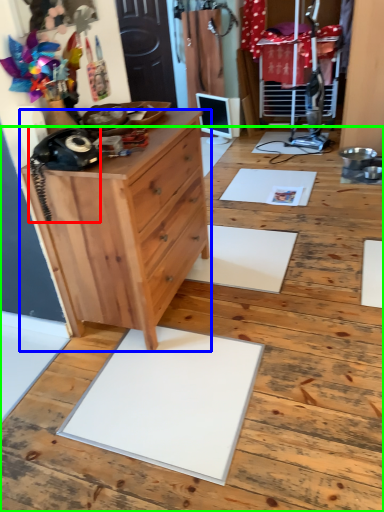
Question: Based on their relative distances, which object is nearer to equipment (highlighted by a red box)? Choose from chest of drawers (highlighted by a blue box) and hardwood (highlighted by a green box).

Choices:
 (A) chest of drawers
 (B) hardwood

Answer: (A)